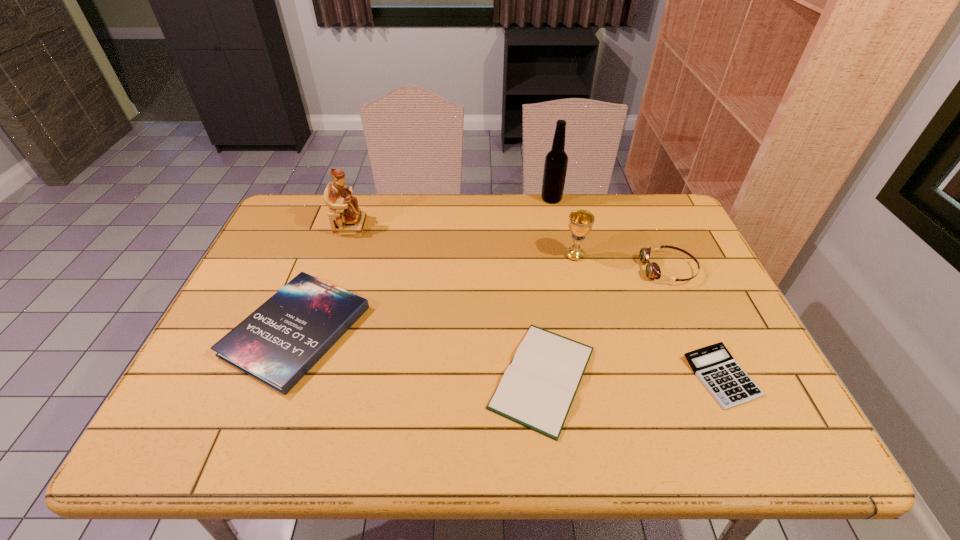
Find the location of a particular element. This screenshot has height=540, width=960. figurine located in the far edge section of the desktop is located at coordinates (346, 218).

Identify the location of object at the near edge. This screenshot has height=540, width=960. (537, 390).

Locate an element on the screen. This screenshot has width=960, height=540. object that is at the left edge is located at coordinates (277, 344).

Locate an element on the screen. Image resolution: width=960 pixels, height=540 pixels. goggles located at the right edge is located at coordinates (652, 270).

Where is `calculator situated at the right edge`? Image resolution: width=960 pixels, height=540 pixels. calculator situated at the right edge is located at coordinates (728, 383).

Image resolution: width=960 pixels, height=540 pixels. In the image, there is a desktop. Find the location of `free space at the far edge`. free space at the far edge is located at coordinates (361, 202).

Where is `free space at the near edge of the desktop`? This screenshot has height=540, width=960. free space at the near edge of the desktop is located at coordinates click(x=407, y=453).

Find the location of a particular element. This screenshot has width=960, height=540. blank space at the right edge of the desktop is located at coordinates (701, 300).

You are a GUI agent. You are given a task and a screenshot of the screen. Output one action in this format:
    pyautogui.click(x=<x>, y=<y>)
    Task: Click on the vacant space at the near right corner of the desktop
    The width and height of the screenshot is (960, 540).
    Given the screenshot: What is the action you would take?
    pyautogui.click(x=796, y=437)

Identify the location of free space between the goggles and the shortest object. (695, 323).